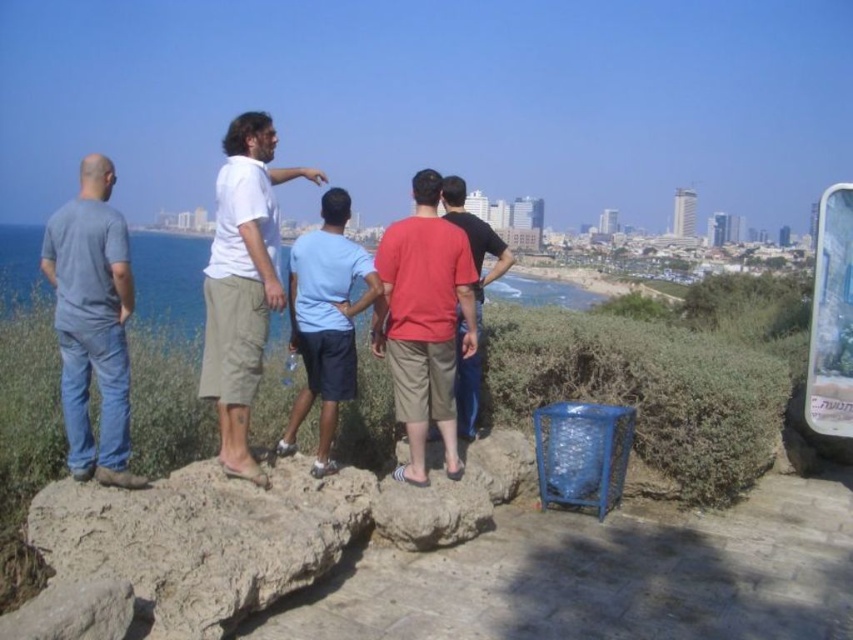
Which is behind, point (245, 352) or point (370, 298)?

The point (370, 298) is more distant.

Can you confirm if light beige shorts at center is positioned to the left of light blue fabric shorts at center?

Correct, you'll find light beige shorts at center to the left of light blue fabric shorts at center.

Is point (242, 312) positioned before point (332, 246)?

Yes, point (242, 312) is in front of point (332, 246).

Find the location of a particular element. The image size is (853, 640). light beige shorts at center is located at coordinates (242, 282).

Between red cotton shirt at center and light blue fabric shorts at center, which one appears on the right side from the viewer's perspective?

Positioned to the right is red cotton shirt at center.

Who is more distant from viewer, (410, 221) or (299, 326)?

The point (410, 221) is behind.

Image resolution: width=853 pixels, height=640 pixels. In order to click on red cotton shirt at center in this screenshot , I will do `click(424, 321)`.

Which is behind, point (228, 147) or point (494, 273)?

Point (494, 273)

Between light beige shorts at center and matte red shirt at center, which one is positioned higher?

Positioned higher is matte red shirt at center.

Is point (225, 424) positioned in front of point (471, 243)?

Yes, it is.

The width and height of the screenshot is (853, 640). Identify the location of light beige shorts at center. (242, 282).